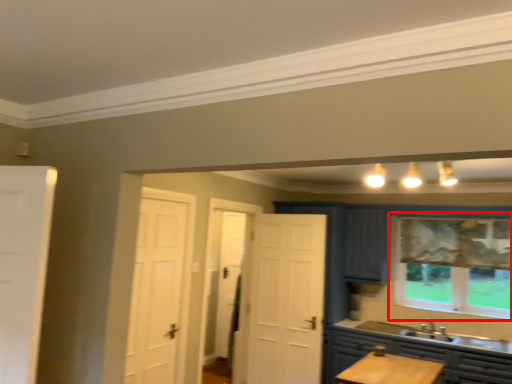
Question: From the image, what is the correct spatial relationship of window (annotated by the red box) in relation to cabinetry?

Choices:
 (A) right
 (B) left

Answer: (A)